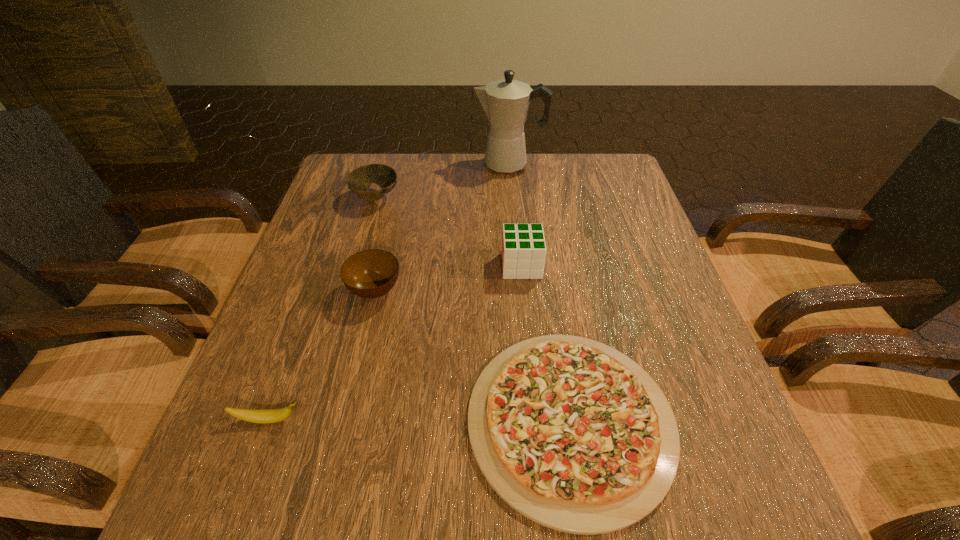
At what (x,y) coordinates should I click in order to perform the action: click on free space that satisfies the following two spatial constraints: 1. on the front side of the pizza; 2. on the right side of the second farthest object. Please return your answer as a coordinate pair (x, y). The width and height of the screenshot is (960, 540). Looking at the image, I should click on (312, 421).

Find the location of `free region that satisfies the following two spatial constraints: 1. on the red face of the cube; 2. on the left side of the pizza`. free region that satisfies the following two spatial constraints: 1. on the red face of the cube; 2. on the left side of the pizza is located at coordinates (537, 421).